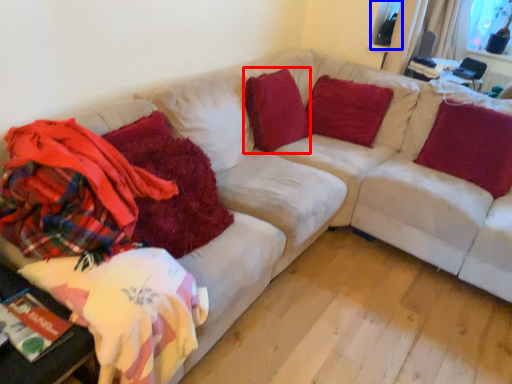
Question: Which of the following is the farthest to the observer, pillow (highlighted by a red box) or window screen (highlighted by a blue box)?

Choices:
 (A) pillow
 (B) window screen

Answer: (B)